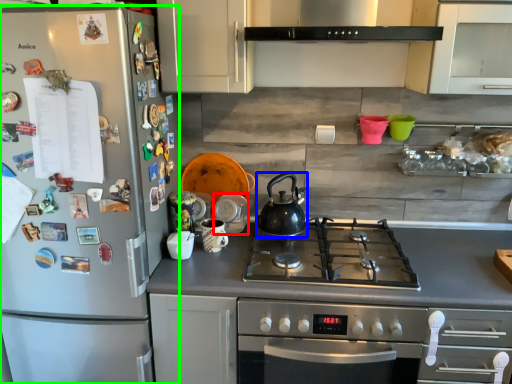
Question: Based on their relative distances, which object is nearer to appliance (highlighted by a red box)? Choose from kettle (highlighted by a blue box) and refrigerator (highlighted by a green box).

Choices:
 (A) kettle
 (B) refrigerator

Answer: (A)